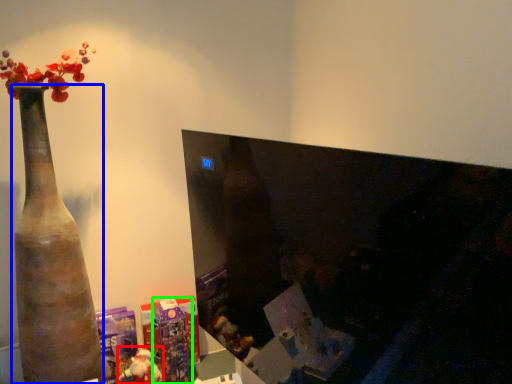
Question: Which object is positioned closest to toy (highlighted by a red box)? Select from vase (highlighted by a blue box) and toy (highlighted by a green box).

Choices:
 (A) vase
 (B) toy

Answer: (B)